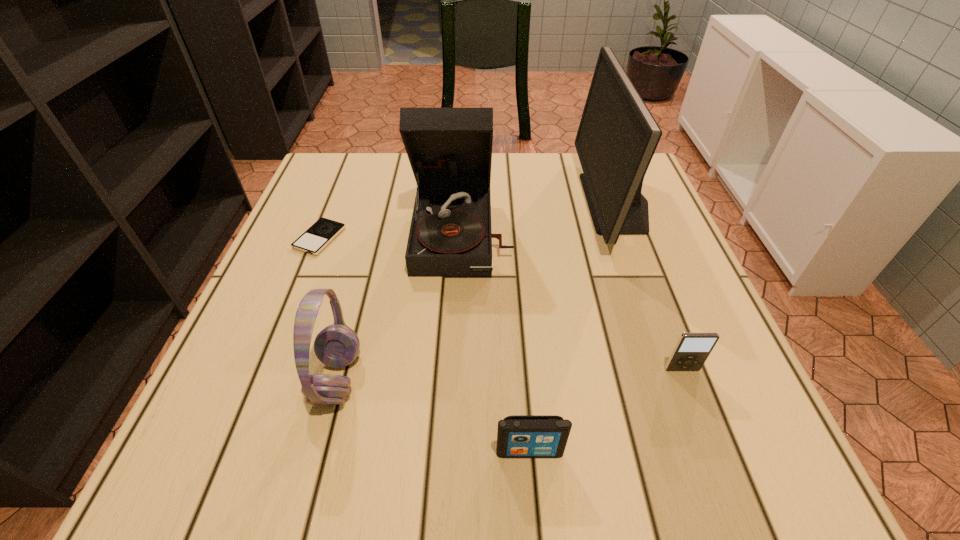
At what (x,y) coordinates should I click in order to perform the action: click on vacant space at the far right corner of the desktop. Please return your answer as a coordinate pair (x, y). This screenshot has height=540, width=960. Looking at the image, I should click on (652, 189).

I want to click on vacant space that's between the rightmost iPod and the phonograph_record, so (x=572, y=301).

I want to click on free space between the phonograph_record and the headset, so click(x=400, y=305).

The image size is (960, 540). What are the coordinates of `vacant space that's between the nearest iPod and the computer monitor` in the screenshot? It's located at (573, 327).

The width and height of the screenshot is (960, 540). Identify the location of empty location between the farthest iPod and the second farthest iPod. (501, 303).

What are the coordinates of `empty space that is in between the nearest object and the farthest iPod` in the screenshot? It's located at (424, 345).

Where is `free spot between the phonograph_record and the headset`? The width and height of the screenshot is (960, 540). free spot between the phonograph_record and the headset is located at coordinates (400, 305).

Where is `empty space that is in between the phonograph_record and the rightmost iPod`? empty space that is in between the phonograph_record and the rightmost iPod is located at coordinates (572, 301).

Find the location of `unoccupied position between the nearest iPod and the leftmost object`. unoccupied position between the nearest iPod and the leftmost object is located at coordinates (424, 345).

Where is `vacant area between the shortest iPod and the rightmost iPod`? This screenshot has height=540, width=960. vacant area between the shortest iPod and the rightmost iPod is located at coordinates (501, 303).